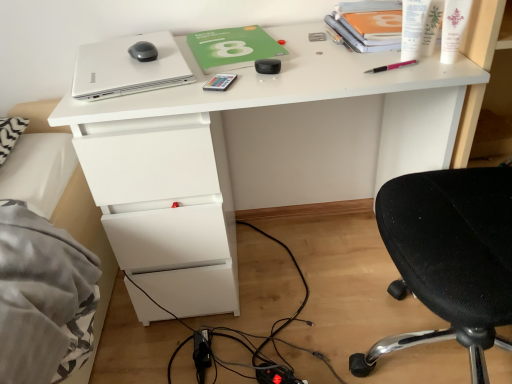
Find the location of a particular element. The image size is (512, 384). vacant space behind white plastic pen at upper right, the 3th stationery when ordered from left to right is located at coordinates (362, 46).